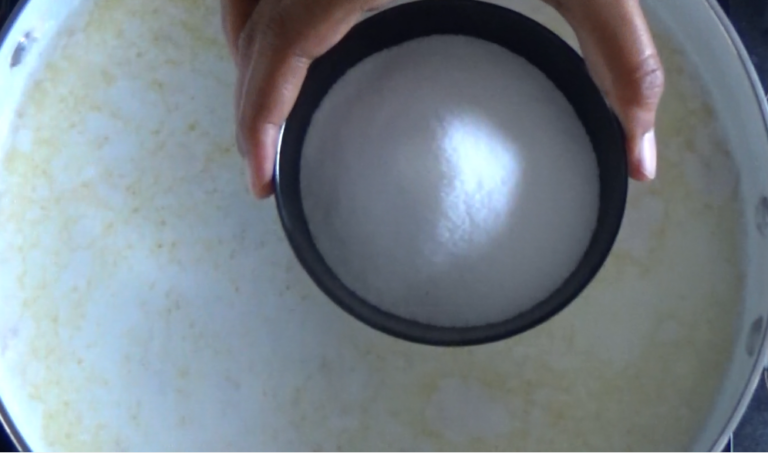
What are the coordinates of `frying pan rim` in the screenshot? It's located at (746, 60), (15, 20), (11, 432), (740, 406).